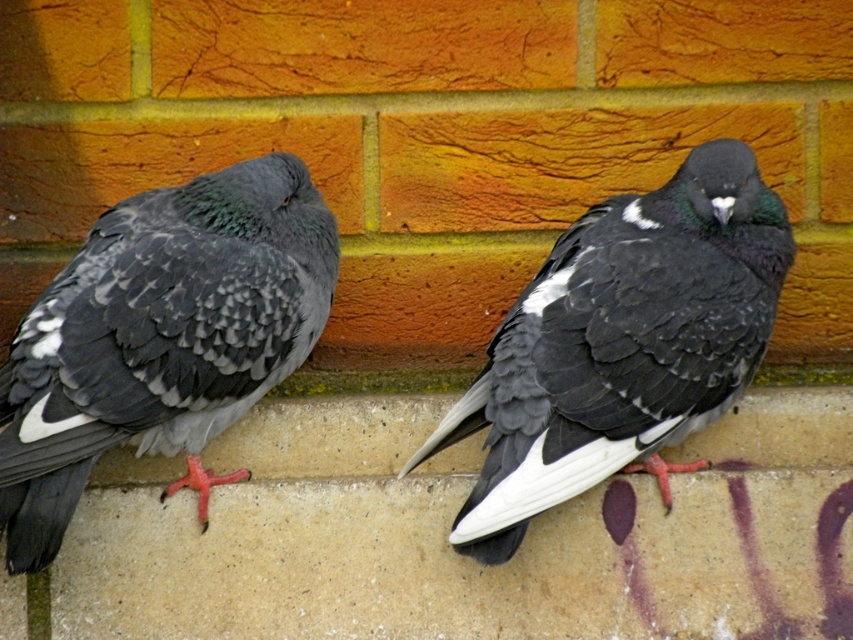
Consider the image. You are a birdwatcher standing 10 feet away from the concreteroughpigeons at lower center. You want to observe both pigeons without moving closer. Can you see both pigeons clearly from your current position?

The concreteroughpigeons at lower center are 6.65 feet apart. Since you are standing 10 feet away from them, the distance between the pigeons is less than your distance from them, so you can see both pigeons clearly without needing to move closer.

You are a birdwatcher observing the scene. You notice two pigeons, the concreteroughpigeons at lower center and the black matte pigeon at center. Which pigeon is closer to you?

The concreteroughpigeons at lower center is closer to you because the black matte pigeon at center is positioned behind it.

You are a birdwatcher observing two pigeons on a concrete surface. You notice a matte gray pigeon at center and a black matte pigeon at center. Which pigeon has a shorter height?

The matte gray pigeon at center is not as tall as the black matte pigeon at center, so the matte gray pigeon at center has a shorter height.